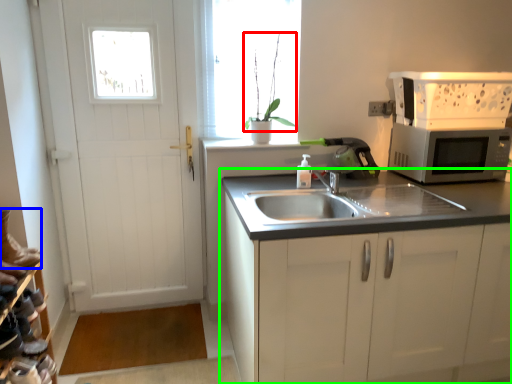
Question: Which object is positioned farthest from plant (highlighted by a red box)? Select from running shoe (highlighted by a blue box) and cabinetry (highlighted by a green box).

Choices:
 (A) running shoe
 (B) cabinetry

Answer: (A)